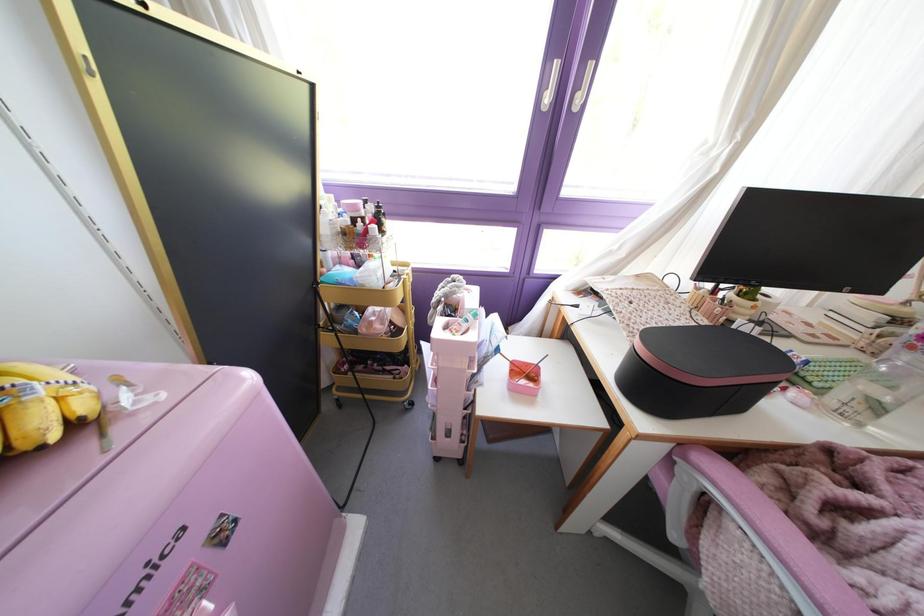
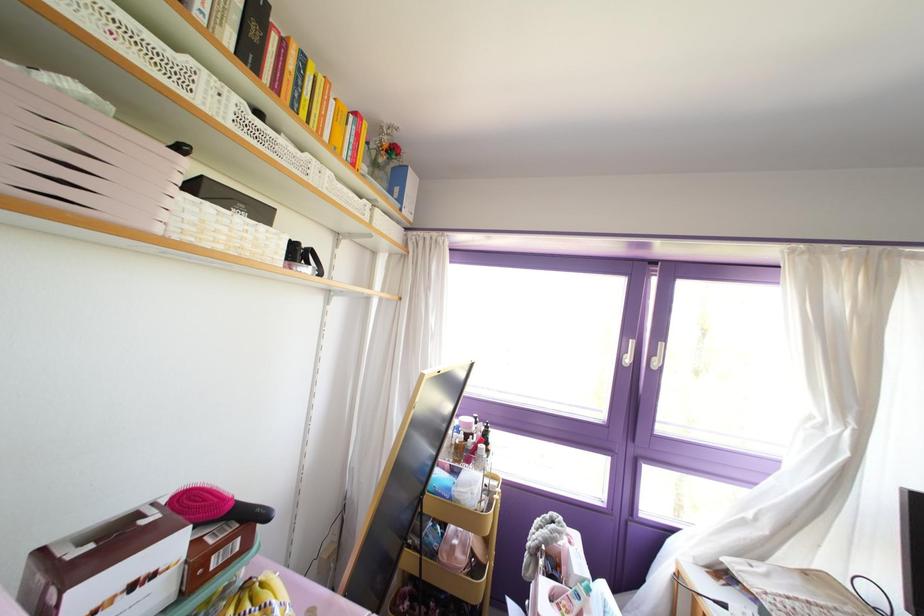
The point at [546,99] is marked in the first image. Where is the corresponding point in the second image?

(626, 360)